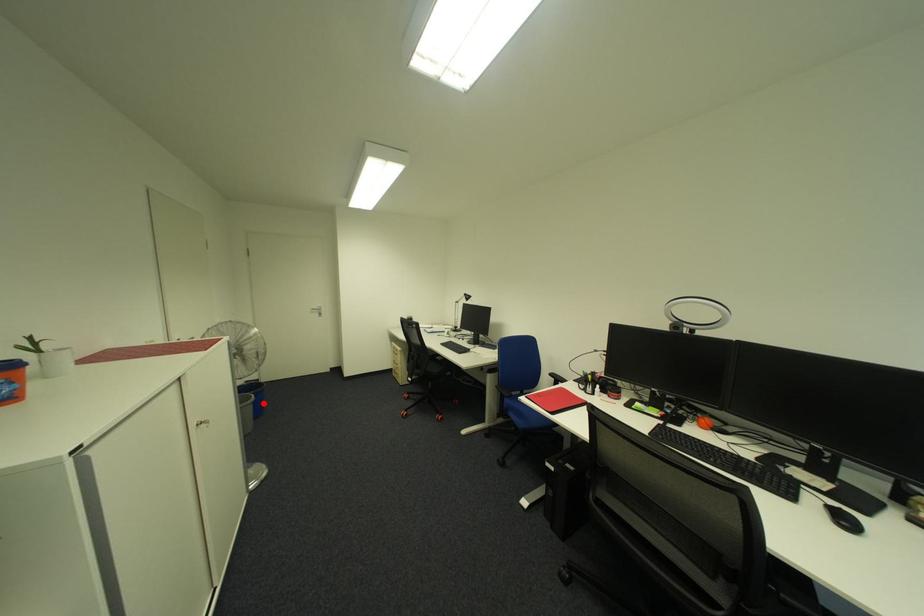
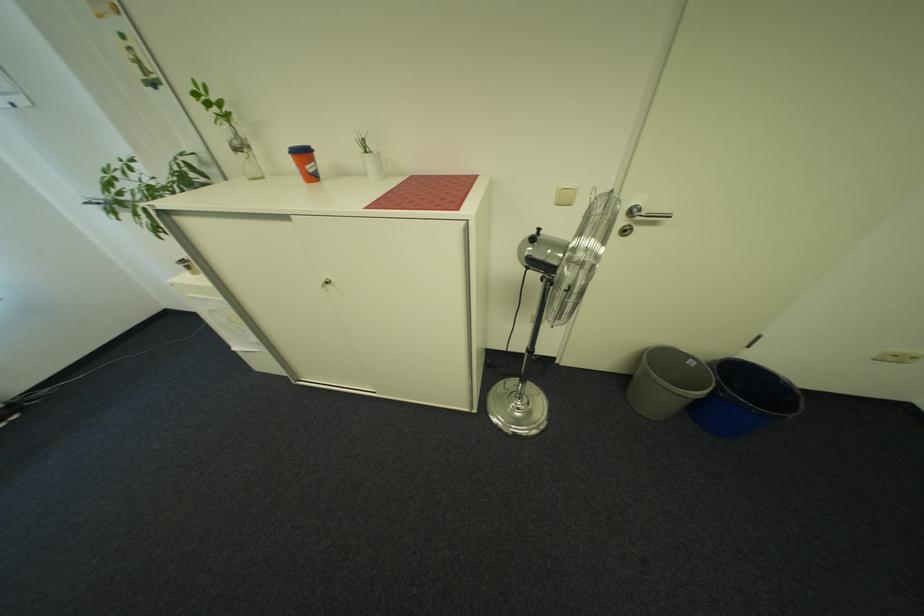
Question: I am providing you with two images of the same scene from different viewpoints. Given a red point in image1, look at the same physical point in image2. Is it:

Choices:
 (A) Closer to the viewpoint
 (B) Farther from the viewpoint

Answer: (A)